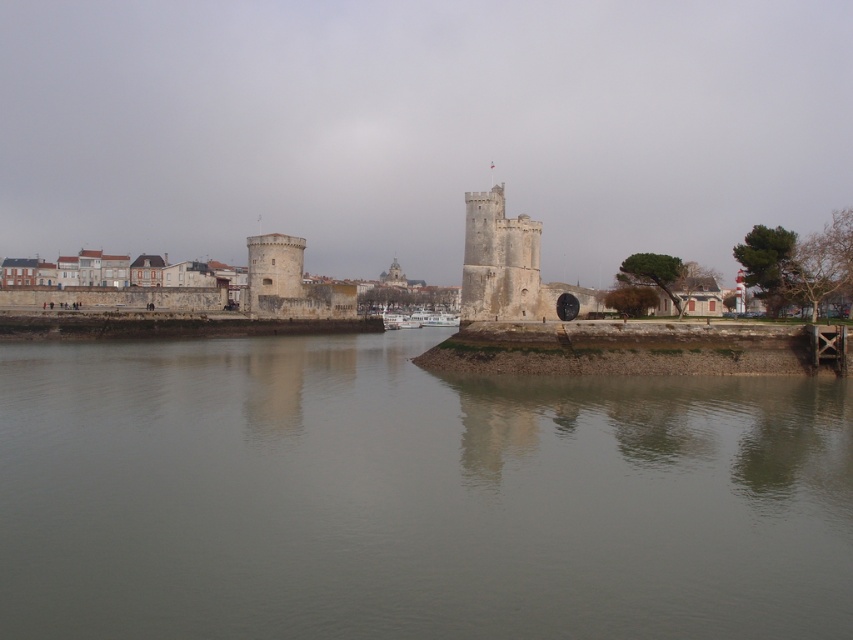
You are a tourist standing on the riverbank and want to take a photo of the gray concrete river at center and the stone tower at center. Which object will appear taller in your photo?

The stone tower at center will appear taller in the photo because the gray concrete river at center is not as tall as it.

You are standing at the base of the historic stone tower in the riverside scene. You notice two points marked on the tower wall. One is at coordinate point (393, 609) and the other at point (496, 237). Which point would appear larger to you from your current position?

Point (393, 609) is closer to the camera, so it would appear larger than point (496, 237) from your current position.

You are a tourist standing on the riverbank and want to take a photo of the gray concrete river at center and the stone tower at center. Which object should you position to your left side to capture both in the frame?

The gray concrete river at center is to the left of the stone tower at center, so you should position the stone tower at center to your right side so that the gray concrete river at center will be on the left side of the frame, allowing both to be captured.